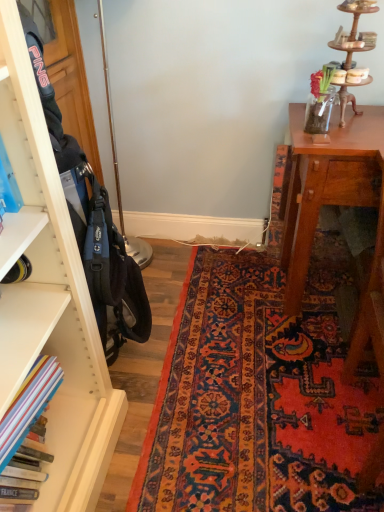
Question: Should I look upward or downward to see hardcover books at left?

Choices:
 (A) down
 (B) up

Answer: (A)

Question: Is the surface of carpet with intricate patterns at center in direct contact with hardcover books at left?

Choices:
 (A) no
 (B) yes

Answer: (A)

Question: Is carpet with intricate patterns at center bigger than hardcover books at left?

Choices:
 (A) no
 (B) yes

Answer: (B)

Question: From the image's perspective, is carpet with intricate patterns at center located above hardcover books at left?

Choices:
 (A) yes
 (B) no

Answer: (A)

Question: Can you confirm if carpet with intricate patterns at center is taller than hardcover books at left?

Choices:
 (A) yes
 (B) no

Answer: (B)

Question: Can you confirm if carpet with intricate patterns at center is smaller than hardcover books at left?

Choices:
 (A) yes
 (B) no

Answer: (B)

Question: Does carpet with intricate patterns at center lie behind hardcover books at left?

Choices:
 (A) yes
 (B) no

Answer: (A)

Question: From a real-world perspective, is hardcover books at left positioned under carpet with intricate patterns at center based on gravity?

Choices:
 (A) yes
 (B) no

Answer: (B)

Question: Can you confirm if hardcover books at left is bigger than carpet with intricate patterns at center?

Choices:
 (A) yes
 (B) no

Answer: (B)

Question: Considering the relative positions of hardcover books at left and carpet with intricate patterns at center in the image provided, is hardcover books at left to the right of carpet with intricate patterns at center from the viewer's perspective?

Choices:
 (A) no
 (B) yes

Answer: (A)

Question: Considering the relative sizes of hardcover books at left and carpet with intricate patterns at center in the image provided, is hardcover books at left taller than carpet with intricate patterns at center?

Choices:
 (A) yes
 (B) no

Answer: (A)

Question: Can you confirm if hardcover books at left is smaller than carpet with intricate patterns at center?

Choices:
 (A) no
 (B) yes

Answer: (B)

Question: Is hardcover books at left at the left side of carpet with intricate patterns at center?

Choices:
 (A) no
 (B) yes

Answer: (B)

Question: From a real-world perspective, relative to hardcover books at left, is carpet with intricate patterns at center vertically above or below?

Choices:
 (A) below
 (B) above

Answer: (A)